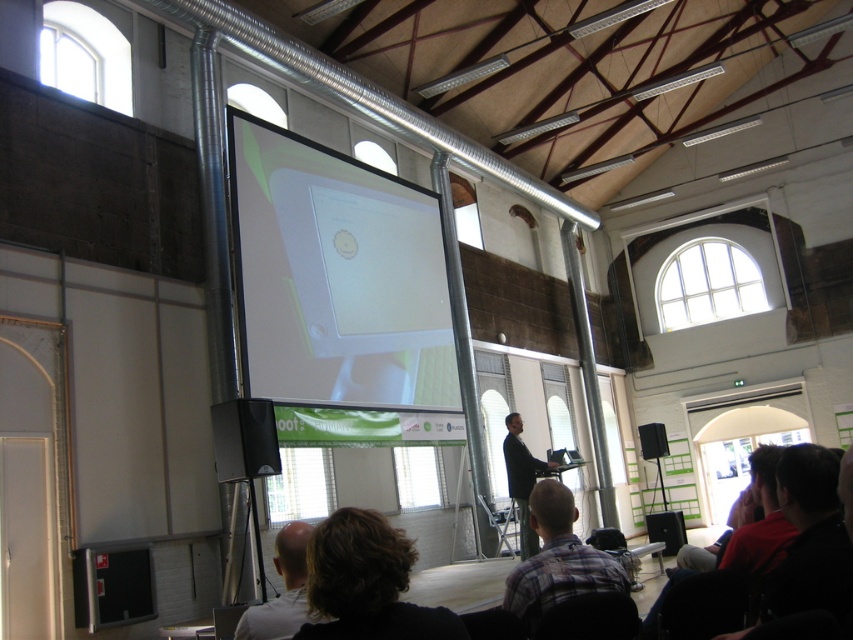
Question: Is white glossy projector screen at center above black fabric speaker at lower right?

Choices:
 (A) yes
 (B) no

Answer: (A)

Question: Which object appears farthest from the camera in this image?

Choices:
 (A) black plastic speaker at lower right
 (B) black fabric speaker at lower right

Answer: (A)

Question: Is brown hair at lower center to the right of light brown hair at lower center from the viewer's perspective?

Choices:
 (A) no
 (B) yes

Answer: (B)

Question: Which point is closer to the camera?

Choices:
 (A) black plastic speaker at lower right
 (B) dark brown leather jacket at center
 (C) white glossy projector screen at center

Answer: (B)

Question: Which is nearer to the black fabric speaker at lower right?

Choices:
 (A) brown hair at lower center
 (B) light brown hair at lower center
 (C) dark brown leather jacket at center

Answer: (C)

Question: Does light brown hair at lower center have a smaller size compared to black plastic speaker at lower right?

Choices:
 (A) yes
 (B) no

Answer: (A)